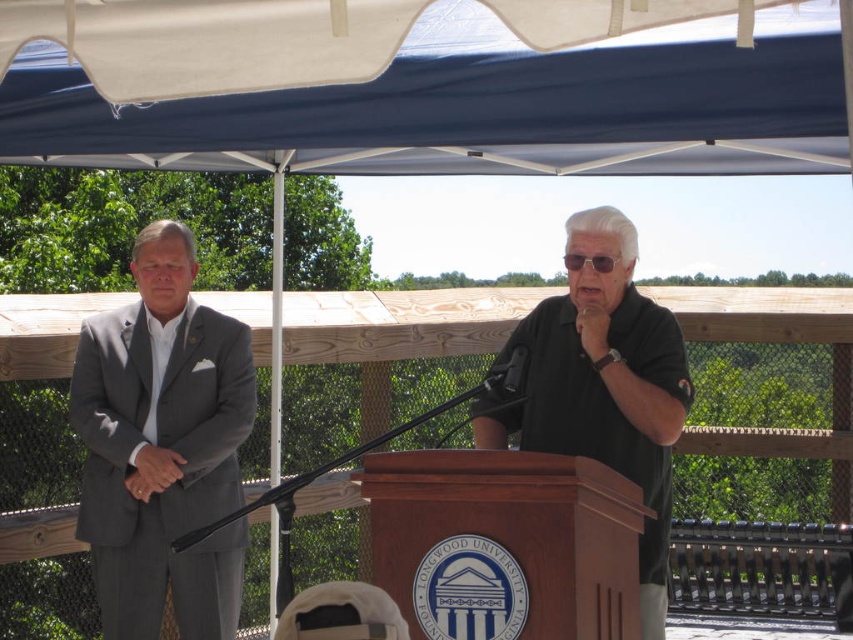
You are standing at the front of the canopy tent and want to place two markers at the coordinates point (164, 100) and point (161, 516). Which marker will appear larger in the image?

Point (164, 100) is closer to the camera than point (161, 516), so the marker at point (164, 100) will appear larger in the image.

You are standing at the point labeled as point [161,445] in the image. Which object is directly in front of you?

The gray suit at left is directly in front of you at point 0.691, 0.191.

You are a photographer standing at the back of the event. You need to take a photo of the white fabric canopy at upper center and the black matte shirt at center. However, you notice an obstruction. Which object is more likely to be blocked by the other?

The white fabric canopy at upper center is not as tall as the black matte shirt at center, so the black matte shirt at center may block the view of the white fabric canopy at upper center in the photo.